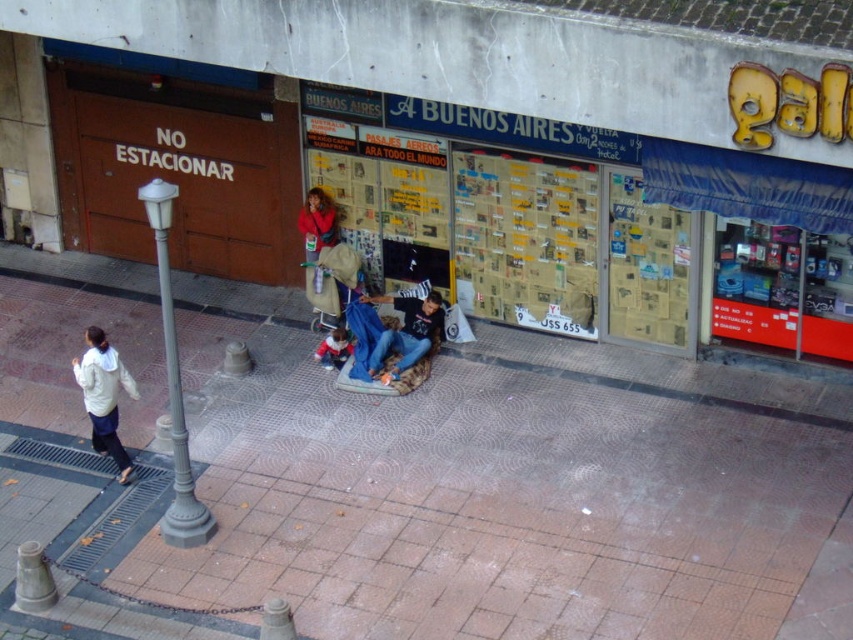
Between brown brick pavement at center and white matte jacket at lower left, which one is positioned lower?

brown brick pavement at center

Who is higher up, brown brick pavement at center or white matte jacket at lower left?

Positioned higher is white matte jacket at lower left.

This screenshot has height=640, width=853. What do you see at coordinates (438, 486) in the screenshot?
I see `brown brick pavement at center` at bounding box center [438, 486].

You are a GUI agent. You are given a task and a screenshot of the screen. Output one action in this format:
    pyautogui.click(x=<x>, y=<y>)
    Task: Click on the brown brick pavement at center
    
    Given the screenshot: What is the action you would take?
    pyautogui.click(x=438, y=486)

Is white matte jacket at lower left shorter than denim jeans at center?

No, white matte jacket at lower left is not shorter than denim jeans at center.

You are a GUI agent. You are given a task and a screenshot of the screen. Output one action in this format:
    pyautogui.click(x=<x>, y=<y>)
    Task: Click on the white matte jacket at lower left
    This screenshot has width=853, height=640.
    Given the screenshot: What is the action you would take?
    pyautogui.click(x=103, y=396)

Which is in front, point (108, 369) or point (383, 333)?

Point (108, 369)

Where is `white matte jacket at lower left`? white matte jacket at lower left is located at coordinates (103, 396).

Which is in front, point (189, 396) or point (387, 337)?

Point (387, 337) is in front.

Looking at this image, does brown brick pavement at center appear under denim jeans at center?

Yes, brown brick pavement at center is below denim jeans at center.

Identify the location of brown brick pavement at center. The image size is (853, 640). (438, 486).

What are the coordinates of `brown brick pavement at center` in the screenshot? It's located at (438, 486).